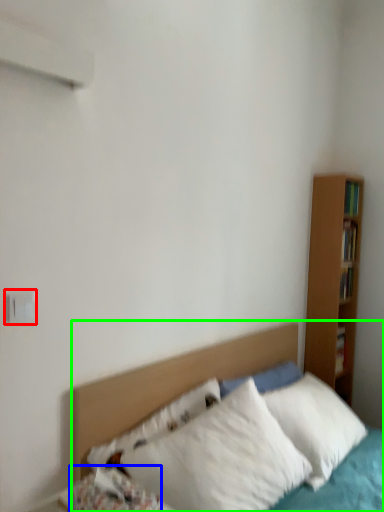
Question: Which object is positioned closest to electric outlet (highlighted by a red box)? Select from pillow (highlighted by a blue box) and bed (highlighted by a green box).

Choices:
 (A) pillow
 (B) bed

Answer: (A)